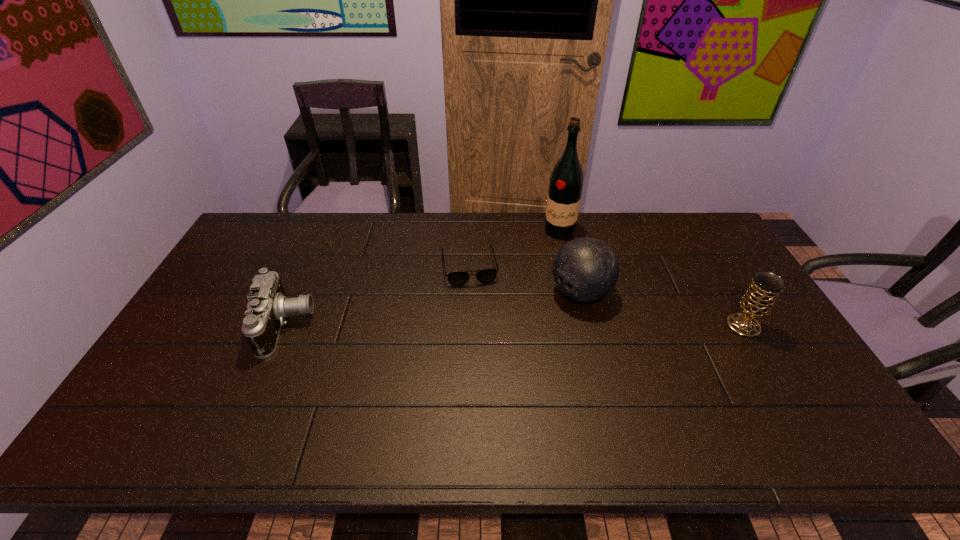
Locate an element on the screen. Image resolution: width=960 pixels, height=540 pixels. vacant space that is in between the fourth tallest object and the spectacles is located at coordinates (377, 296).

Where is `vacant space that is in between the spectacles and the chalice`? The image size is (960, 540). vacant space that is in between the spectacles and the chalice is located at coordinates (607, 296).

Locate an element on the screen. This screenshot has width=960, height=540. free spot between the farthest object and the chalice is located at coordinates (652, 279).

I want to click on vacant space that is in between the bowling ball and the second shortest object, so click(433, 309).

You are a GUI agent. You are given a task and a screenshot of the screen. Output one action in this format:
    pyautogui.click(x=<x>, y=<y>)
    Task: Click on the empty location between the rightmost object and the bowling ball
    The image size is (960, 540).
    Given the screenshot: What is the action you would take?
    pyautogui.click(x=662, y=310)

Image resolution: width=960 pixels, height=540 pixels. I want to click on vacant area that lies between the rightmost object and the fourth tallest object, so click(515, 326).

Identify which object is located as the fourth nearest to the liquor. Please provide its 2D coordinates. Your answer should be formatted as a tuple, i.e. [(x, y)], where the tuple contains the x and y coordinates of a point satisfying the conditions above.

[(268, 306)]

The image size is (960, 540). I want to click on the third closest object relative to the chalice, so click(x=485, y=276).

Locate an element on the screen. free space in the image that satisfies the following two spatial constraints: 1. on the front side of the liquor; 2. on the right side of the chalice is located at coordinates (581, 326).

The height and width of the screenshot is (540, 960). Find the location of `vacant space that satisfies the following two spatial constraints: 1. on the front side of the liquor; 2. on the left side of the bowling ball`. vacant space that satisfies the following two spatial constraints: 1. on the front side of the liquor; 2. on the left side of the bowling ball is located at coordinates (573, 293).